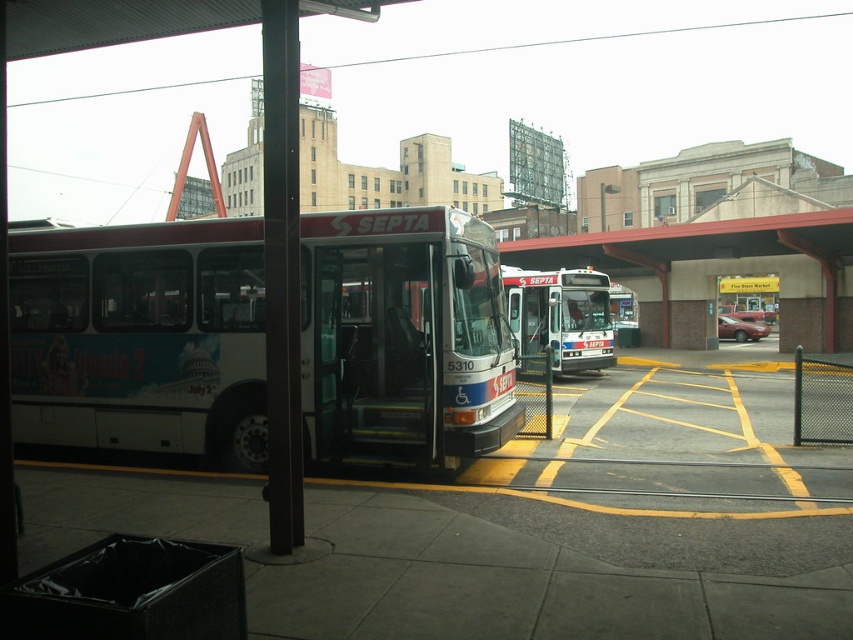
This screenshot has width=853, height=640. Identify the location of white matte bus at center. (141, 339).

In the scene shown: Is white matte bus at center thinner than white glossy bus at center?

Yes.

Does point (483, 420) lie behind point (547, 316)?

No.

At what (x,y) coordinates should I click in order to perform the action: click on white matte bus at center. Please return your answer as a coordinate pair (x, y). Looking at the image, I should click on (141, 339).